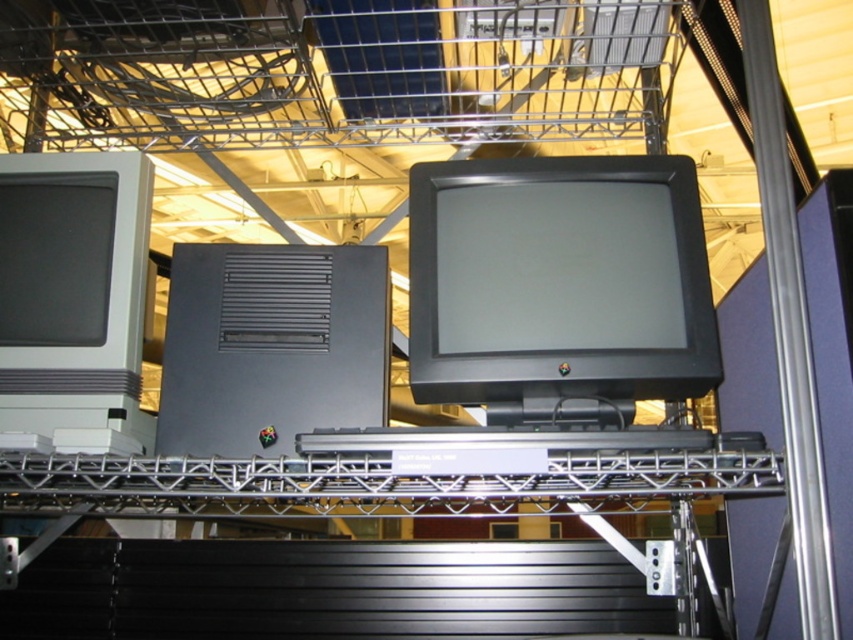
Question: Considering the relative positions of matte black monitor at center and matte gray monitor at left in the image provided, where is matte black monitor at center located with respect to matte gray monitor at left?

Choices:
 (A) right
 (B) left

Answer: (A)

Question: Which object is the closest to the black plastic computer at center?

Choices:
 (A) matte gray monitor at left
 (B) matte black monitor at center

Answer: (A)

Question: Is black plastic computer at center above matte gray monitor at left?

Choices:
 (A) no
 (B) yes

Answer: (A)

Question: Is matte black monitor at center further to camera compared to matte gray monitor at left?

Choices:
 (A) no
 (B) yes

Answer: (B)

Question: Which object is the closest to the matte gray monitor at left?

Choices:
 (A) matte black monitor at center
 (B) black plastic computer at center

Answer: (B)

Question: Based on their relative distances, which object is farther from the black plastic computer at center?

Choices:
 (A) matte black monitor at center
 (B) matte gray monitor at left

Answer: (A)